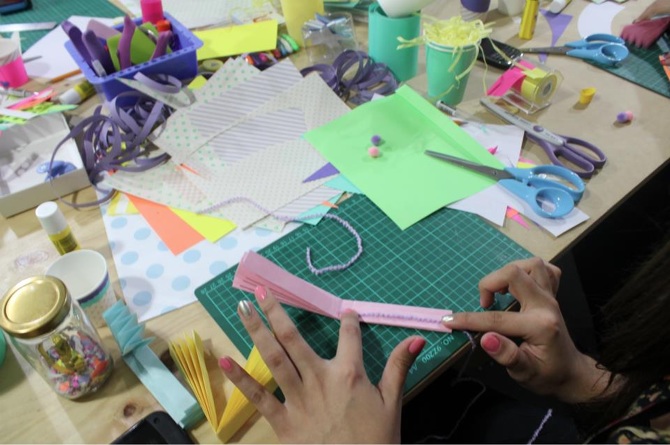
At what (x,y) coordinates should I click in order to perform the action: click on grid mats. Please return your answer as a coordinate pair (x, y). The width and height of the screenshot is (670, 445). Looking at the image, I should click on (388, 260), (47, 6), (643, 62).